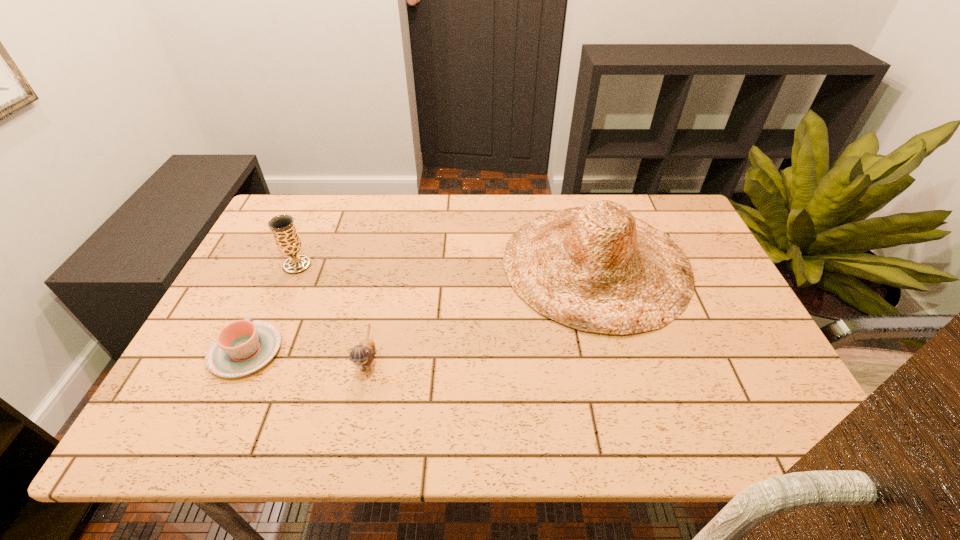
Locate an element on the screen. The width and height of the screenshot is (960, 540). object at the far edge is located at coordinates (596, 268).

The height and width of the screenshot is (540, 960). Identify the location of chalice that is at the left edge. (288, 242).

Locate an element on the screen. This screenshot has width=960, height=540. chinaware present at the left edge is located at coordinates (242, 347).

Where is `object that is positioned at the right edge`? The height and width of the screenshot is (540, 960). object that is positioned at the right edge is located at coordinates (596, 268).

Where is `object at the far right corner`? Image resolution: width=960 pixels, height=540 pixels. object at the far right corner is located at coordinates (596, 268).

Identify the location of vacant point at the far edge. The width and height of the screenshot is (960, 540). (326, 232).

The image size is (960, 540). What are the coordinates of `free region at the near edge of the desktop` in the screenshot? It's located at (572, 430).

In the image, there is a desktop. Identify the location of free space at the left edge. (274, 244).

Identify the location of vacant area at the right edge. The width and height of the screenshot is (960, 540). (754, 332).

The width and height of the screenshot is (960, 540). In the image, there is a desktop. Find the location of `vacant area at the far left corner`. vacant area at the far left corner is located at coordinates (302, 213).